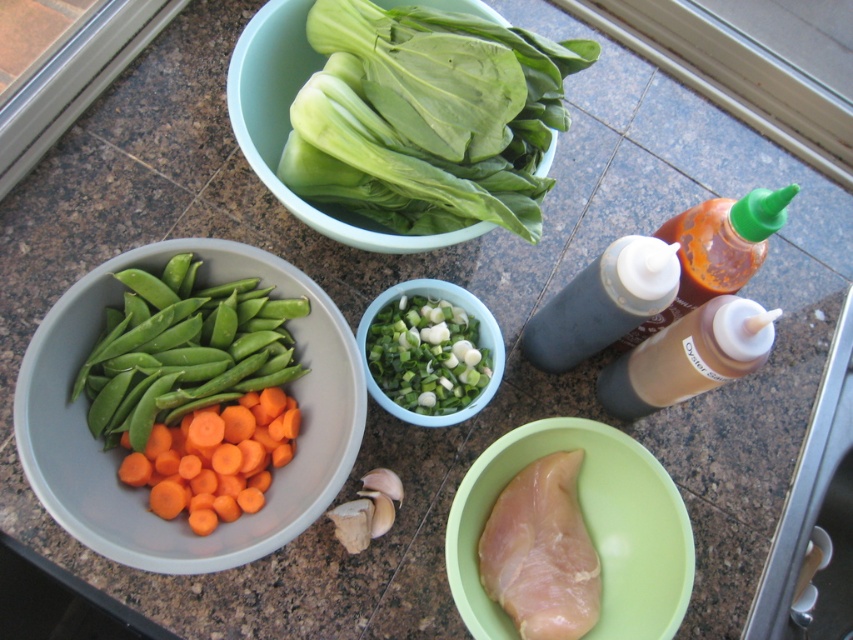
Question: Which point is closer to the camera taking this photo?

Choices:
 (A) (456, 348)
 (B) (245, 480)
 (C) (303, 368)

Answer: (B)

Question: Which point is closer to the camera taking this photo?

Choices:
 (A) (558, 326)
 (B) (144, 560)
 (C) (180, 266)

Answer: (B)

Question: Where is pale pink smooth chicken breast at center located in relation to green/glossy chopped onions at center in the image?

Choices:
 (A) left
 (B) right

Answer: (B)

Question: Can you confirm if orange matte carrot at left is wider than pale green plastic at center?

Choices:
 (A) no
 (B) yes

Answer: (B)

Question: Does brown matte bottle at center-right come in front of translucent plastic bottle at right?

Choices:
 (A) yes
 (B) no

Answer: (A)

Question: Among these points, which one is nearest to the camera?

Choices:
 (A) (793, 188)
 (B) (589, 326)
 (C) (430, 381)
 (D) (166, 401)

Answer: (A)